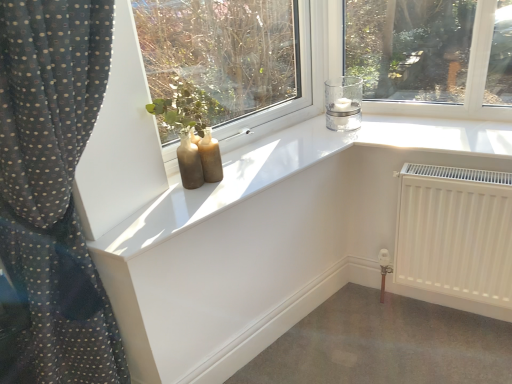
Where is `free location in front of white matte radiator at lower right`? free location in front of white matte radiator at lower right is located at coordinates (456, 353).